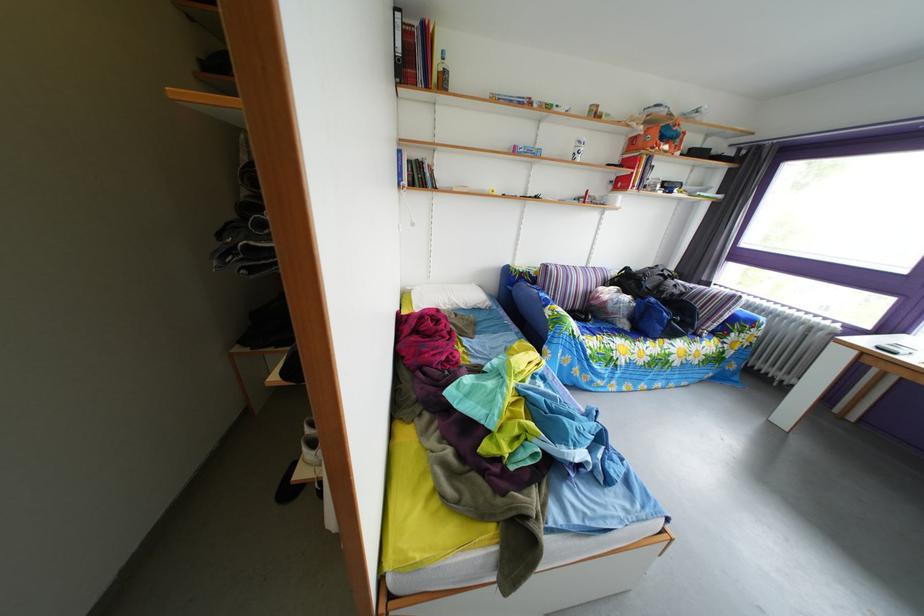
The width and height of the screenshot is (924, 616). Describe the element at coordinates (657, 139) in the screenshot. I see `a orange box` at that location.